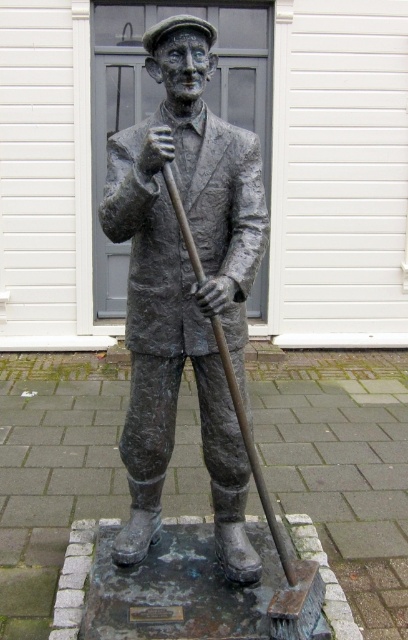
Does bronze statue at center appear on the right side of shiny metal shovel at center?

In fact, bronze statue at center is to the left of shiny metal shovel at center.

Is bronze statue at center wider than shiny metal shovel at center?

No, bronze statue at center is not wider than shiny metal shovel at center.

Find the location of a particular element. bronze statue at center is located at coordinates (184, 285).

Where is `bronze statue at center`? bronze statue at center is located at coordinates click(184, 285).